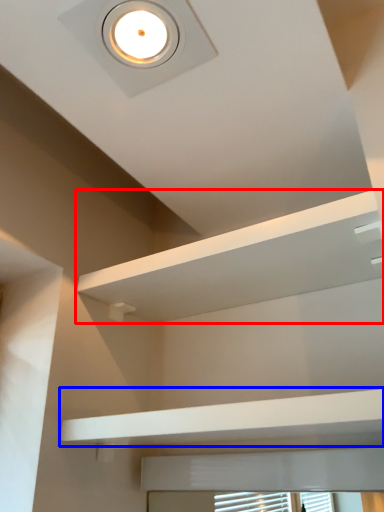
Question: Among these objects, which one is farthest to the camera, shelf (highlighted by a red box) or balustrade (highlighted by a blue box)?

Choices:
 (A) shelf
 (B) balustrade

Answer: (A)